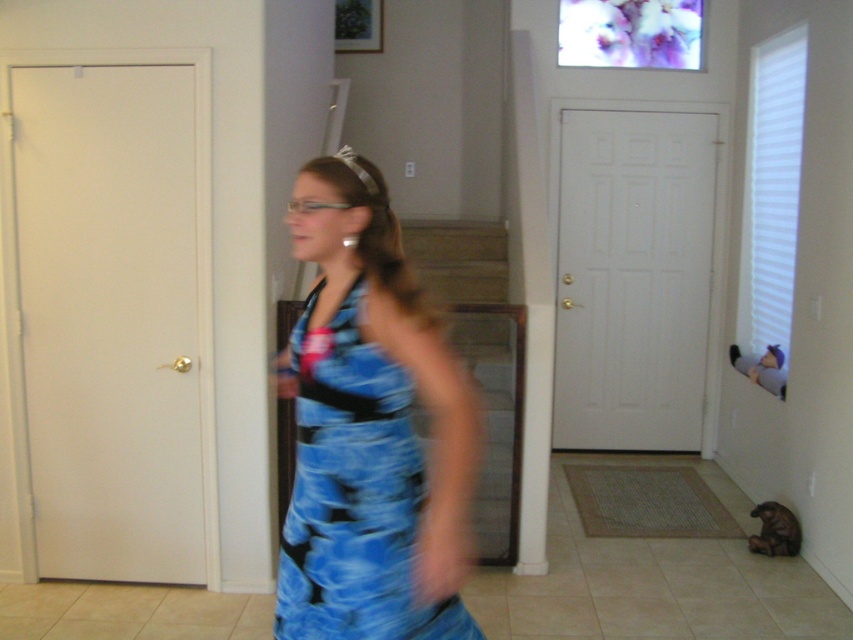
Question: From the image, what is the correct spatial relationship of blue printed fabric dress at center in relation to silver metallic tiara at upper center?

Choices:
 (A) below
 (B) above

Answer: (A)

Question: Does blue printed fabric dress at center have a larger size compared to silver metallic tiara at upper center?

Choices:
 (A) yes
 (B) no

Answer: (A)

Question: Which of the following is the farthest from the observer?

Choices:
 (A) (360, 468)
 (B) (375, 182)

Answer: (B)

Question: Which point is closer to the camera?

Choices:
 (A) silver metallic tiara at upper center
 (B) blue printed fabric dress at center

Answer: (B)

Question: Which object appears farthest from the camera in this image?

Choices:
 (A) blue printed fabric dress at center
 (B) silver metallic tiara at upper center

Answer: (B)

Question: Is blue printed fabric dress at center smaller than silver metallic tiara at upper center?

Choices:
 (A) no
 (B) yes

Answer: (A)